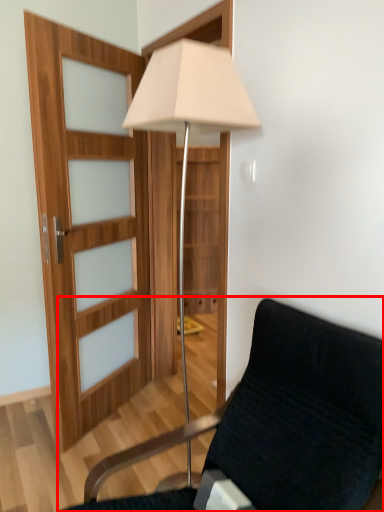
Question: From the image's perspective, what is the correct spatial positioning of chair (annotated by the red box) in reference to lamp?

Choices:
 (A) above
 (B) below

Answer: (B)